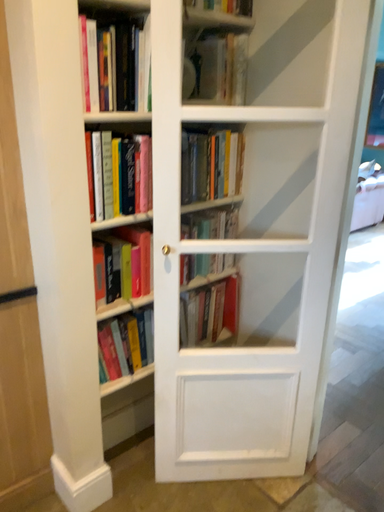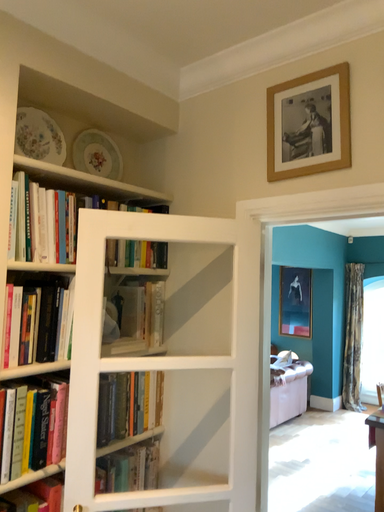
Question: How did the camera likely rotate when shooting the video?

Choices:
 (A) rotated upward
 (B) rotated downward

Answer: (A)